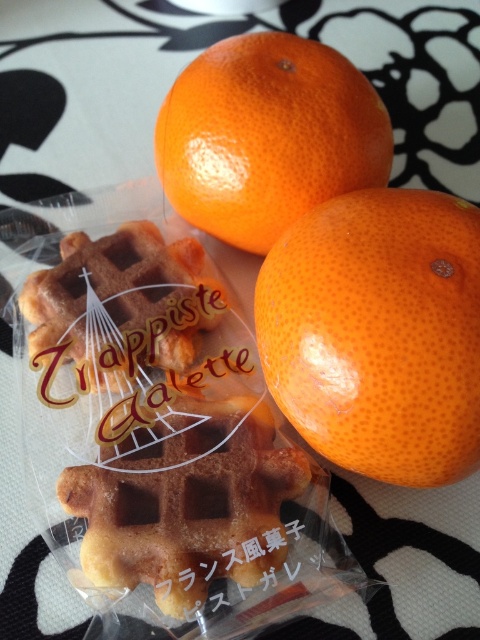
Which is more to the left, golden brown waffle at center or brown/crumbly waffle at center?

brown/crumbly waffle at center is more to the left.

Is golden brown waffle at center behind brown/crumbly waffle at center?

No, golden brown waffle at center is in front of brown/crumbly waffle at center.

What are the coordinates of `golden brown waffle at center` in the screenshot? It's located at (188, 502).

Does point (408, 300) come behind point (188, 557)?

No, it is not.

This screenshot has height=640, width=480. Identify the location of orangesmoothorange at right. (377, 333).

Can you confirm if orangesmoothorange at right is positioned above brown/crumbly waffle at center?

No.

Is orangesmoothorange at right below brown/crumbly waffle at center?

Yes.

Identify the location of orangesmoothorange at right. The image size is (480, 640). (377, 333).